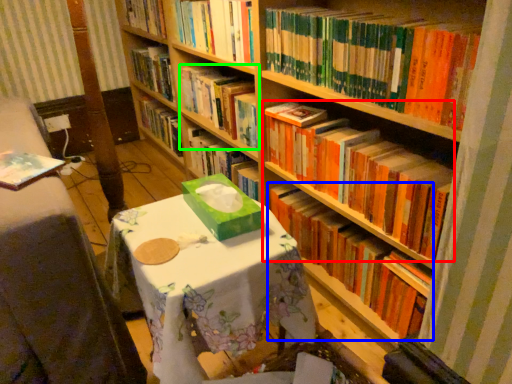
Question: Which is nearer to the book (highlighted by a red box)? book (highlighted by a blue box) or book (highlighted by a green box).

Choices:
 (A) book
 (B) book

Answer: (A)